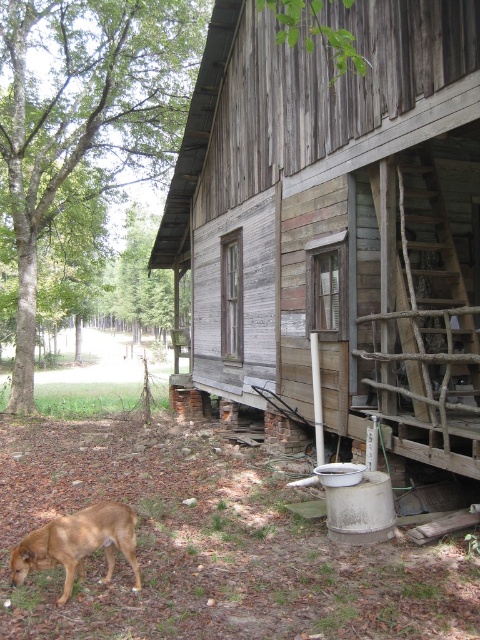
Question: Is weathered wood cabin at center closer to camera compared to brown furry dog at lower left?

Choices:
 (A) yes
 (B) no

Answer: (B)

Question: Among these points, which one is nearest to the camera?

Choices:
 (A) (386, 266)
 (B) (84, 513)

Answer: (B)

Question: Does weathered wood cabin at center have a lesser width compared to brown furry dog at lower left?

Choices:
 (A) no
 (B) yes

Answer: (A)

Question: Which object appears farthest from the camera in this image?

Choices:
 (A) brown furry dog at lower left
 (B) weathered wood cabin at center

Answer: (B)

Question: Is weathered wood cabin at center thinner than brown furry dog at lower left?

Choices:
 (A) no
 (B) yes

Answer: (A)